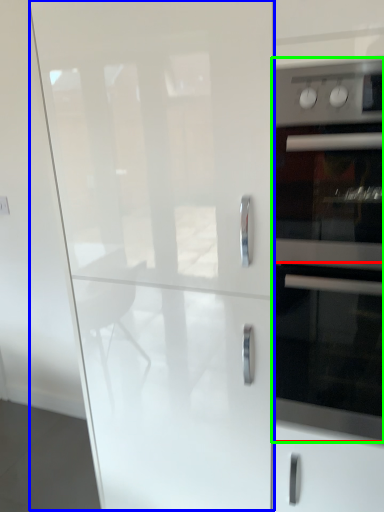
Question: Estimate the real-world distances between objects in this image. Which object is closer to oven (highlighted by a red box), glass door (highlighted by a blue box) or home appliance (highlighted by a green box)?

Choices:
 (A) glass door
 (B) home appliance

Answer: (B)